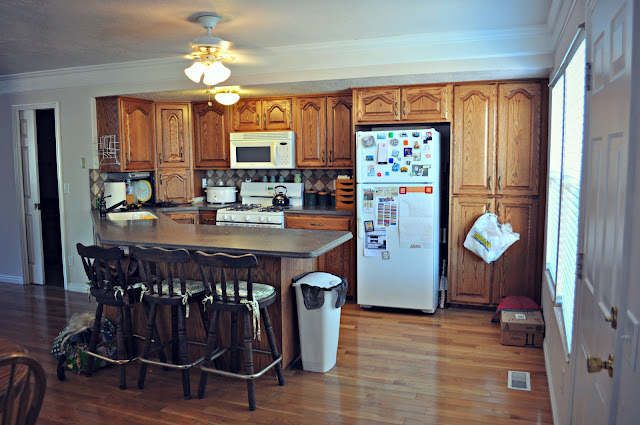
The height and width of the screenshot is (425, 640). In order to click on freezer in this screenshot , I will do `click(406, 158)`.